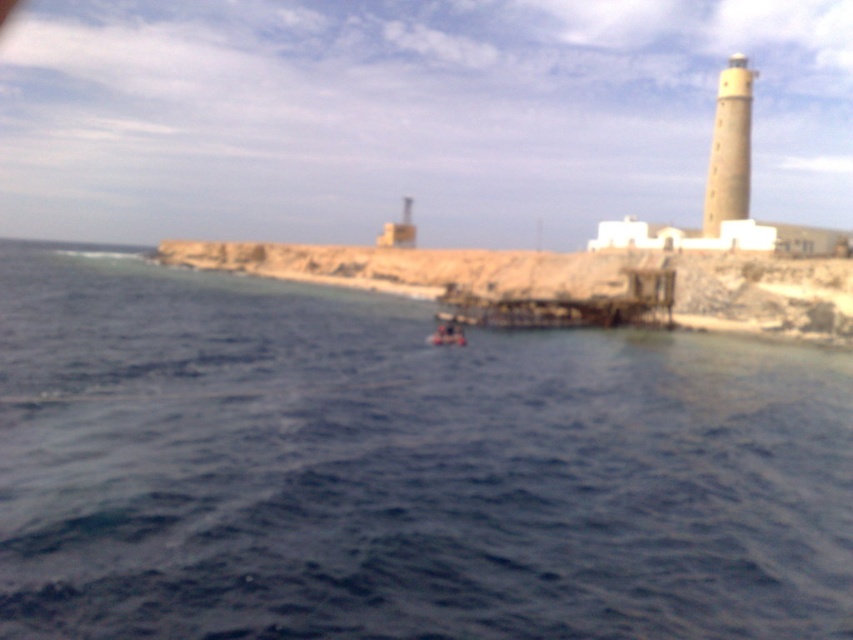
Describe the element at coordinates (399, 468) in the screenshot. The height and width of the screenshot is (640, 853). I see `blue water at center` at that location.

Who is positioned more to the left, blue water at center or beige concrete tower at upper right?

From the viewer's perspective, blue water at center appears more on the left side.

Locate an element on the screen. blue water at center is located at coordinates (399, 468).

Between point (553, 259) and point (456, 336), which one is positioned in front?

Point (456, 336) is more forward.

Locate an element on the screen. brown rocky shoreline at center is located at coordinates (564, 280).

This screenshot has height=640, width=853. Identify the location of brown rocky shoreline at center. (564, 280).

Can you confirm if beige concrete tower at upper right is positioned to the right of metallic red boat at center?

Correct, you'll find beige concrete tower at upper right to the right of metallic red boat at center.

Does beige concrete tower at upper right have a larger size compared to metallic red boat at center?

Correct, beige concrete tower at upper right is larger in size than metallic red boat at center.

Between point (733, 214) and point (448, 321), which one is positioned behind?

Positioned behind is point (733, 214).

Locate an element on the screen. This screenshot has height=640, width=853. beige concrete tower at upper right is located at coordinates (729, 148).